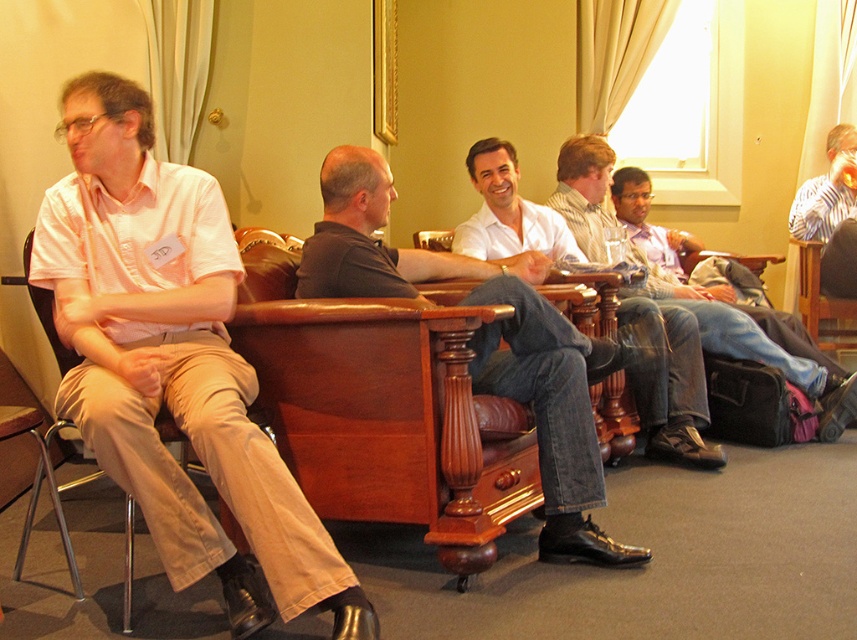
Does khaki pants at left appear under metallic silver armchair at left?

Indeed, khaki pants at left is positioned under metallic silver armchair at left.

Locate an element on the screen. khaki pants at left is located at coordinates pos(172,362).

Where is `khaki pants at left`? This screenshot has width=857, height=640. khaki pants at left is located at coordinates (172, 362).

Which of these two, denim jeans at center or metallic silver armchair at left, stands shorter?

With less height is metallic silver armchair at left.

Which is below, denim jeans at center or metallic silver armchair at left?

metallic silver armchair at left is below.

The width and height of the screenshot is (857, 640). Describe the element at coordinates (748, 342) in the screenshot. I see `denim jeans at center` at that location.

The height and width of the screenshot is (640, 857). What are the coordinates of `denim jeans at center` in the screenshot? It's located at (748, 342).

From the picture: Between khaki pants at left and striped shirt at upper right, which one has more height?

Standing taller between the two is khaki pants at left.

Is point (222, 412) more distant than point (800, 220)?

No.

Where is `khaki pants at left`? Image resolution: width=857 pixels, height=640 pixels. khaki pants at left is located at coordinates (172, 362).